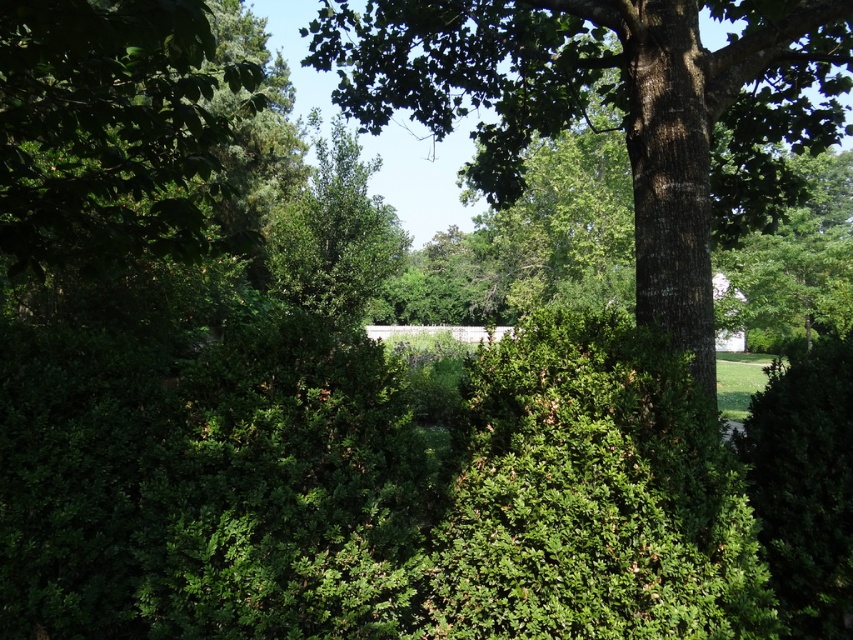
Does green rough bark tree at center come in front of green leafy tree at left?

No, it is not.

Which is in front, point (662, 280) or point (196, 195)?

Point (662, 280) is in front.

Identify the location of green rough bark tree at center. (614, 108).